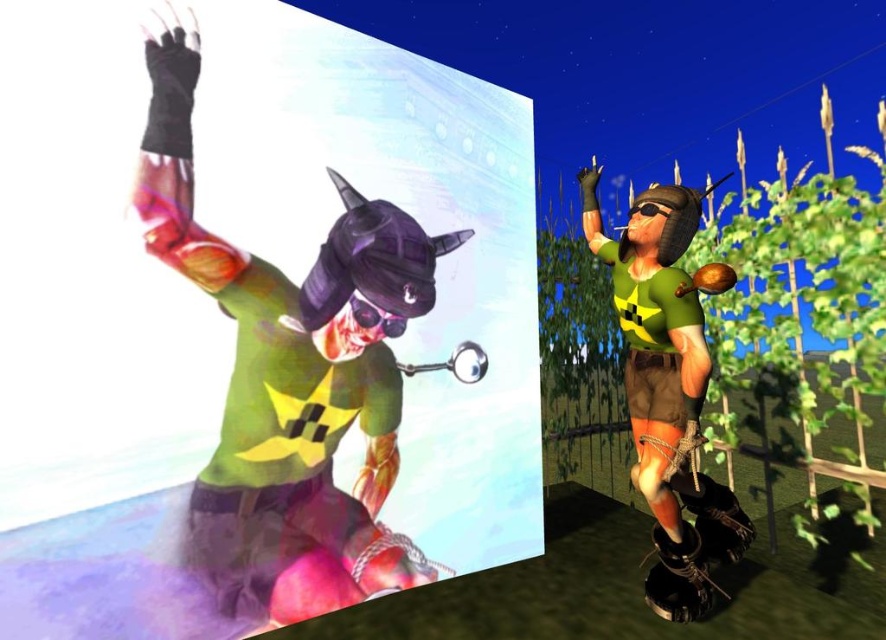
Question: Is matte green t-shirt at upper left above green matte shirt at center?

Choices:
 (A) no
 (B) yes

Answer: (B)

Question: Considering the relative positions of matte green t-shirt at upper left and green matte shirt at center in the image provided, where is matte green t-shirt at upper left located with respect to green matte shirt at center?

Choices:
 (A) right
 (B) left

Answer: (B)

Question: Considering the relative positions of matte green t-shirt at upper left and green matte shirt at center in the image provided, where is matte green t-shirt at upper left located with respect to green matte shirt at center?

Choices:
 (A) right
 (B) left

Answer: (B)

Question: Among these points, which one is nearest to the camera?

Choices:
 (A) (672, 424)
 (B) (379, 509)

Answer: (A)